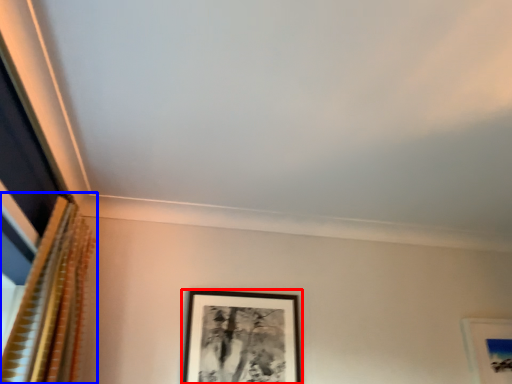
Question: Among these objects, which one is nearest to the camera, picture frame (highlighted by a red box) or curtain (highlighted by a blue box)?

Choices:
 (A) picture frame
 (B) curtain

Answer: (B)